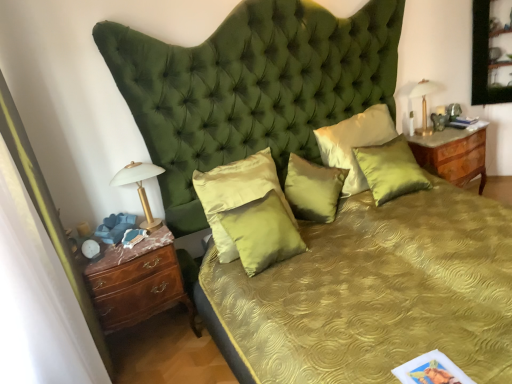
This screenshot has height=384, width=512. Describe the element at coordinates (453, 155) in the screenshot. I see `burlwood/marble nightstand at right` at that location.

Where is `brown wood chest of drawers at left`? The image size is (512, 384). brown wood chest of drawers at left is located at coordinates (138, 283).

How much space does satin green pillow at center, which ranks as the first pillow in right-to-left order, occupy horizontally?

It is 3.06 inches.

What do you see at coordinates (355, 143) in the screenshot? I see `satin green pillow at center, which is the fourth pillow from left to right` at bounding box center [355, 143].

The width and height of the screenshot is (512, 384). I want to click on satin green pillow at center, which is counted as the second pillow, starting from the left, so click(x=262, y=232).

Considering the positions of point (165, 261) and point (439, 161), is point (165, 261) closer or farther from the camera than point (439, 161)?

Point (165, 261).

From a real-world perspective, is brown wood chest of drawers at left on top of burlwood/marble nightstand at right?

No, from a real-world perspective, brown wood chest of drawers at left is not over burlwood/marble nightstand at right

Between white glass bedside lamp at left, acting as the first bedside lamp starting from the bottom, and satin green pillow at center, the 5th pillow when ordered from left to right, which one has smaller width?

satin green pillow at center, the 5th pillow when ordered from left to right.

How distant is white glass bedside lamp at left, marked as the 1th bedside lamp in a front-to-back arrangement, from satin green pillow at center, the 5th pillow when ordered from left to right?

The distance of white glass bedside lamp at left, marked as the 1th bedside lamp in a front-to-back arrangement, from satin green pillow at center, the 5th pillow when ordered from left to right, is 4.67 feet.

Would you consider white glass bedside lamp at left, marked as the 1th bedside lamp in a front-to-back arrangement, to be distant from satin green pillow at center, the 5th pillow when ordered from left to right?

Indeed, white glass bedside lamp at left, marked as the 1th bedside lamp in a front-to-back arrangement, is not near satin green pillow at center, the 5th pillow when ordered from left to right.

Is white glass bedside lamp at left, which is the 2th bedside lamp from back to front, aimed at satin green pillow at center, which ranks as the first pillow in right-to-left order?

No, white glass bedside lamp at left, which is the 2th bedside lamp from back to front, does not turn towards satin green pillow at center, which ranks as the first pillow in right-to-left order.

From a real-world perspective, which is physically below, satin green pillow at center, which appears as the 3th pillow when viewed from the left, or brown wood chest of drawers at left?

In real-world perspective, brown wood chest of drawers at left is lower.

Based on the photo, could you tell me if satin green pillow at center, which appears as the 3th pillow when viewed from the left, is facing brown wood chest of drawers at left?

No, satin green pillow at center, which appears as the 3th pillow when viewed from the left, is not turned towards brown wood chest of drawers at left.

Considering the positions of objects satin green pillow at center, which appears as the 3th pillow when viewed from the left, and brown wood chest of drawers at left in the image provided, who is more to the left, satin green pillow at center, which appears as the 3th pillow when viewed from the left, or brown wood chest of drawers at left?

brown wood chest of drawers at left.

Does satin green pillow at center, positioned as the third pillow in right-to-left order, have a larger size compared to brown wood chest of drawers at left?

No, satin green pillow at center, positioned as the third pillow in right-to-left order, is not bigger than brown wood chest of drawers at left.

Locate an element on the screen. The image size is (512, 384). nightstand below the satin gold pillow at center, the first pillow from the left (from a real-world perspective) is located at coordinates (453, 155).

Which object is wider, satin gold pillow at center, arranged as the 5th pillow when viewed from the right, or burlwood/marble nightstand at right?

Wider between the two is burlwood/marble nightstand at right.

From a real-world perspective, which is physically above, satin gold pillow at center, arranged as the 5th pillow when viewed from the right, or burlwood/marble nightstand at right?

satin gold pillow at center, arranged as the 5th pillow when viewed from the right, is physically above.

Is point (224, 185) positioned after point (481, 140)?

No, it is in front of (481, 140).

Who is taller, burlwood/marble nightstand at right or white glass bedside lamp at left, positioned as the 2th bedside lamp in top-to-bottom order?

Standing taller between the two is burlwood/marble nightstand at right.

Considering the positions of objects burlwood/marble nightstand at right and white glass bedside lamp at left, the 2th bedside lamp positioned from the right, in the image provided, who is in front, burlwood/marble nightstand at right or white glass bedside lamp at left, the 2th bedside lamp positioned from the right,?

white glass bedside lamp at left, the 2th bedside lamp positioned from the right.

Image resolution: width=512 pixels, height=384 pixels. Identify the location of bedside lamp lying below the burlwood/marble nightstand at right (from the image's perspective). (140, 188).

Choose the correct answer: Is burlwood/marble nightstand at right inside white glass bedside lamp at left, the 2th bedside lamp positioned from the right, or outside it?

burlwood/marble nightstand at right is spatially situated outside white glass bedside lamp at left, the 2th bedside lamp positioned from the right.

Is satin green pillow at center, which is the fourth pillow from left to right, far from gold metallic lamp at upper right, marked as the first bedside lamp in a back-to-front arrangement?

No, there isn't a large distance between satin green pillow at center, which is the fourth pillow from left to right, and gold metallic lamp at upper right, marked as the first bedside lamp in a back-to-front arrangement.

Identify the location of bedside lamp located above the satin green pillow at center, which is the fourth pillow from left to right (from the image's perspective). (423, 104).

From the picture: Is satin green pillow at center, acting as the 2th pillow starting from the right, turned away from gold metallic lamp at upper right, which ranks as the 2th bedside lamp in front-to-back order?

No.

Is satin green pillow at center, acting as the 2th pillow starting from the right, in front of or behind gold metallic lamp at upper right, the 1th bedside lamp from the top, in the image?

In the image, satin green pillow at center, acting as the 2th pillow starting from the right, appears in front of gold metallic lamp at upper right, the 1th bedside lamp from the top.

Which of these two, brown wood chest of drawers at left or satin green pillow at center, the 5th pillow when ordered from left to right, stands shorter?

satin green pillow at center, the 5th pillow when ordered from left to right.

Considering the relative positions of brown wood chest of drawers at left and satin green pillow at center, the 5th pillow when ordered from left to right, in the image provided, is brown wood chest of drawers at left in front of satin green pillow at center, the 5th pillow when ordered from left to right,?

Yes, brown wood chest of drawers at left is in front of satin green pillow at center, the 5th pillow when ordered from left to right.

Is point (98, 272) less distant than point (415, 165)?

Yes, point (98, 272) is in front of point (415, 165).

Looking at this image, which is more to the left, brown wood chest of drawers at left or satin green pillow at center, the 5th pillow when ordered from left to right?

From the viewer's perspective, brown wood chest of drawers at left appears more on the left side.

Locate an element on the screen. chest of drawers below the burlwood/marble nightstand at right (from the image's perspective) is located at coordinates (138, 283).

Where is `bedside lamp located on the left of satin green pillow at center, which ranks as the first pillow in right-to-left order`? bedside lamp located on the left of satin green pillow at center, which ranks as the first pillow in right-to-left order is located at coordinates (140, 188).

Which object lies nearer to the anchor point burlwood/marble nightstand at right, satin green pillow at center, acting as the 2th pillow starting from the right, or satin green pillow at center, positioned as the fourth pillow in right-to-left order?

satin green pillow at center, acting as the 2th pillow starting from the right, lies closer to burlwood/marble nightstand at right than the other object.

Estimate the real-world distances between objects in this image. Which object is closer to white glass bedside lamp at left, marked as the 1th bedside lamp in a front-to-back arrangement, gold metallic lamp at upper right, the second bedside lamp positioned from the left, or satin green pillow at center, which is counted as the second pillow, starting from the left?

satin green pillow at center, which is counted as the second pillow, starting from the left, is closer to white glass bedside lamp at left, marked as the 1th bedside lamp in a front-to-back arrangement.

When comparing their distances from satin green pillow at center, which is counted as the second pillow, starting from the left, does burlwood/marble nightstand at right or brown wood chest of drawers at left seem closer?

brown wood chest of drawers at left is positioned closer to the anchor satin green pillow at center, which is counted as the second pillow, starting from the left.

Looking at this image, when comparing their distances from satin green pillow at center, which is the fourth pillow from left to right, does satin green pillow at center, which is counted as the second pillow, starting from the left, or burlwood/marble nightstand at right seem closer?

burlwood/marble nightstand at right lies closer to satin green pillow at center, which is the fourth pillow from left to right, than the other object.

Estimate the real-world distances between objects in this image. Which object is further from satin gold pillow at center, arranged as the 5th pillow when viewed from the right, burlwood/marble nightstand at right or satin green pillow at center, which is counted as the second pillow, starting from the left?

burlwood/marble nightstand at right is positioned further to the anchor satin gold pillow at center, arranged as the 5th pillow when viewed from the right.

From the image, which object appears to be farther from satin green pillow at center, positioned as the fourth pillow in right-to-left order, satin green pillow at center, the 5th pillow when ordered from left to right, or satin green pillow at center, which appears as the 3th pillow when viewed from the left?

satin green pillow at center, the 5th pillow when ordered from left to right, is further to satin green pillow at center, positioned as the fourth pillow in right-to-left order.

When comparing their distances from brown wood chest of drawers at left, does satin green pillow at center, positioned as the fourth pillow in right-to-left order, or satin green pillow at center, the 5th pillow when ordered from left to right, seem closer?

satin green pillow at center, positioned as the fourth pillow in right-to-left order.

Based on their spatial positions, is satin green pillow at center, positioned as the fourth pillow in right-to-left order, or burlwood/marble nightstand at right closer to brown wood chest of drawers at left?

satin green pillow at center, positioned as the fourth pillow in right-to-left order, is positioned closer to the anchor brown wood chest of drawers at left.

The height and width of the screenshot is (384, 512). Find the location of `bedside lamp located between satin green pillow at center, positioned as the third pillow in right-to-left order, and burlwood/marble nightstand at right in the left-right direction`. bedside lamp located between satin green pillow at center, positioned as the third pillow in right-to-left order, and burlwood/marble nightstand at right in the left-right direction is located at coordinates (423, 104).

Locate an element on the screen. bedside lamp situated between brown wood chest of drawers at left and satin green pillow at center, which is counted as the second pillow, starting from the left, from left to right is located at coordinates (140, 188).

Where is `bedside lamp located between white glass bedside lamp at left, marked as the first bedside lamp in a left-to-right arrangement, and burlwood/marble nightstand at right in the left-right direction`? This screenshot has width=512, height=384. bedside lamp located between white glass bedside lamp at left, marked as the first bedside lamp in a left-to-right arrangement, and burlwood/marble nightstand at right in the left-right direction is located at coordinates (423, 104).

At what (x,y) coordinates should I click in order to perform the action: click on bedside lamp between brown wood chest of drawers at left and gold metallic lamp at upper right, acting as the 2th bedside lamp starting from the bottom, from left to right. Please return your answer as a coordinate pair (x, y). Image resolution: width=512 pixels, height=384 pixels. Looking at the image, I should click on (140, 188).